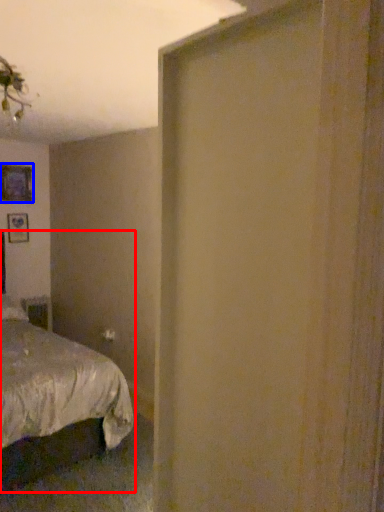
Question: Which of the following is the closest to the observer, bed (highlighted by a red box) or picture frame (highlighted by a blue box)?

Choices:
 (A) bed
 (B) picture frame

Answer: (A)